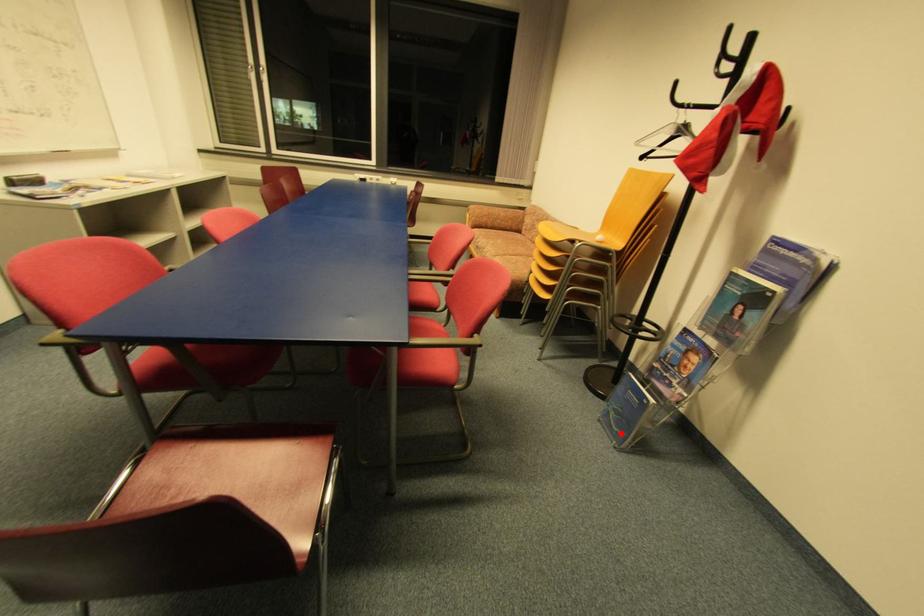
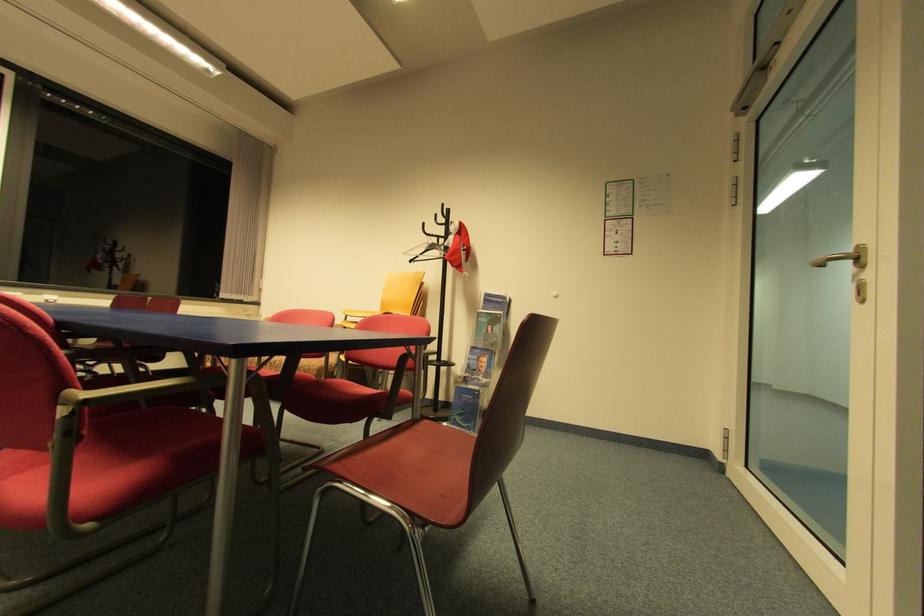
Locate, in the second image, the point that corresponds to the highlighted location in the first image.

(472, 427)